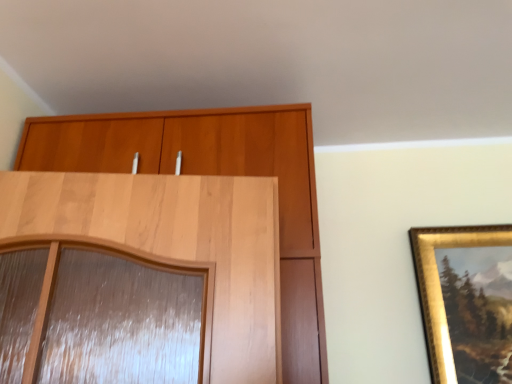
Describe the element at coordinates (215, 174) in the screenshot. I see `light brown wood cupboard at upper center` at that location.

Measure the distance between light brown wood cupboard at upper center and camera.

light brown wood cupboard at upper center and camera are 39.09 inches apart from each other.

What are the coordinates of `light brown wood cupboard at upper center` in the screenshot? It's located at (215, 174).

At what (x,y) coordinates should I click in order to perform the action: click on light brown wood cupboard at upper center. Please return your answer as a coordinate pair (x, y). Image resolution: width=512 pixels, height=384 pixels. Looking at the image, I should click on (215, 174).